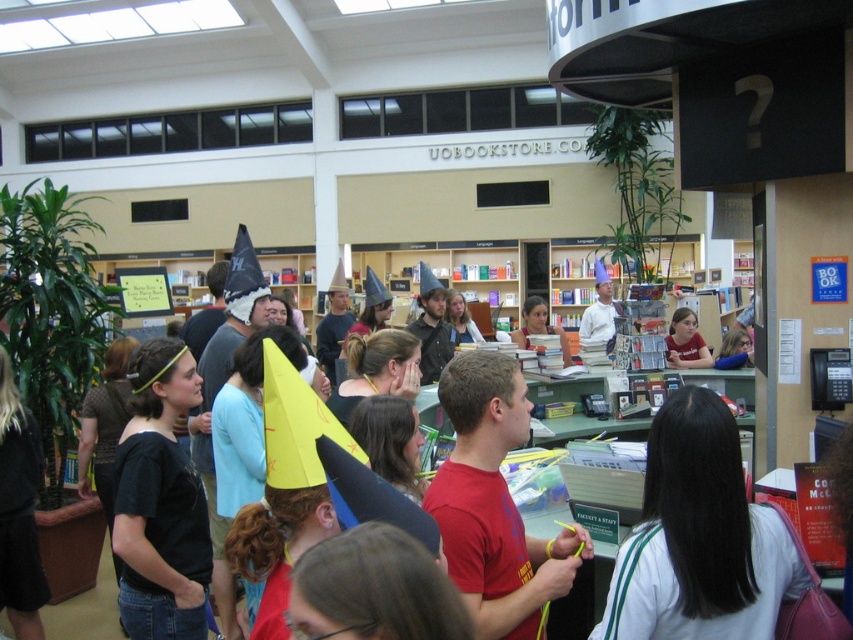
You are a customer standing in the checkout area of the bookstore and notice two shirts at the center. Which shirt is positioned lower between the red matte shirt at center and the matte blue shirt at center?

The red matte shirt at center is below the matte blue shirt at center, so the red matte shirt at center is positioned lower.

You are a customer in the bookstore checkout area and need to identify which staff member is closer to you. You see two staff members wearing a white matte shirt at center and a matte blue shirt at center. Which one is smaller in size?

The white matte shirt at center is smaller than the matte blue shirt at center, so the staff member wearing the white matte shirt at center has a smaller shirt size.

You are a customer trying to reach the customer service desk located behind the checkout counter. There are two people in white matte shirt at center and red matte shirt at center blocking your path. Which person should you ask to move aside so you can pass through?

You should ask the white matte shirt at center to move aside because the white matte shirt at center might be wider than the red matte shirt at center, making it easier to navigate around them.